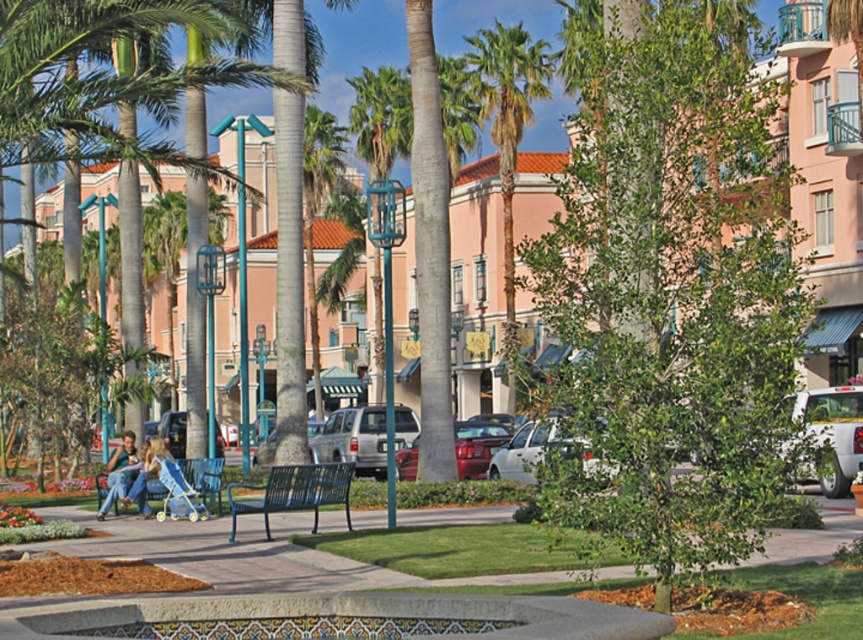
You are standing at the origin point in the park. The park uses a coordinate system where the bottom left corner is the origin. Where is the green leafy tree at center located in this coordinate system?

The green leafy tree at center is located at coordinates point (672, 292).

You are a photographer setting up a tripod in the urban park scene. You need to position your camera so that both the white glossy car at lower right and the matte blue jeans at center are in the frame. Which object will appear taller in the photo?

The white glossy car at lower right will appear taller in the photo because it is much taller than the matte blue jeans at center according to the description.